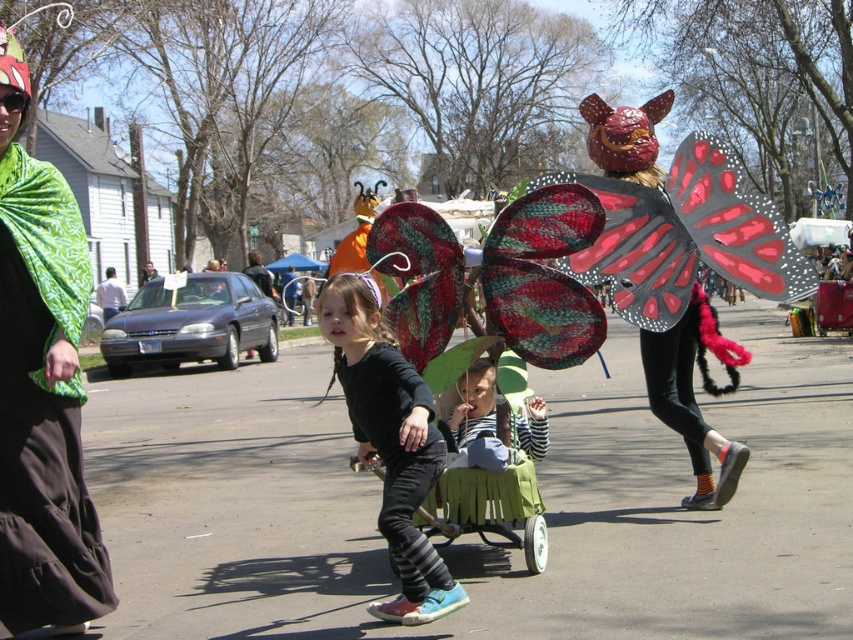
Can you confirm if green patterned scarf at left is bigger than black matte leggings at center?

Yes, green patterned scarf at left is bigger than black matte leggings at center.

Who is positioned more to the right, green patterned scarf at left or black matte leggings at center?

black matte leggings at center is more to the right.

Find the location of a particular element. Image resolution: width=853 pixels, height=640 pixels. green patterned scarf at left is located at coordinates (41, 388).

You are a GUI agent. You are given a task and a screenshot of the screen. Output one action in this format:
    pyautogui.click(x=<x>, y=<y>)
    Task: Click on the black matte leggings at center
    
    Given the screenshot: What is the action you would take?
    pyautogui.click(x=390, y=442)

Is black matte leggings at center taller than striped fabric at center?

Yes.

What do you see at coordinates (390, 442) in the screenshot? The image size is (853, 640). I see `black matte leggings at center` at bounding box center [390, 442].

Where is `black matte leggings at center`? The image size is (853, 640). black matte leggings at center is located at coordinates coord(390,442).

Which is behind, point (47, 609) or point (532, 440)?

Point (532, 440)

This screenshot has width=853, height=640. In order to click on green patterned scarf at left in this screenshot , I will do `click(41, 388)`.